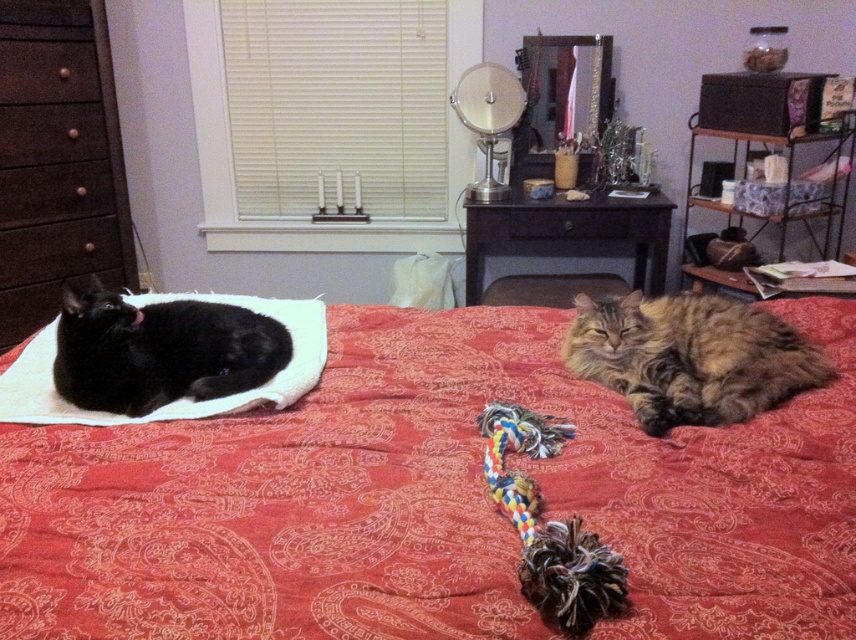
Question: Is tabby fur cat at center smaller than matte black cat at left?

Choices:
 (A) yes
 (B) no

Answer: (B)

Question: Does smooth red fabric bed at center have a smaller size compared to brown wood drawer at left?

Choices:
 (A) no
 (B) yes

Answer: (A)

Question: Which point is closer to the camera?

Choices:
 (A) (798, 502)
 (B) (242, 378)

Answer: (A)

Question: Does tabby fur cat at center appear on the left side of brown wood drawer at left?

Choices:
 (A) no
 (B) yes

Answer: (A)

Question: Which of the following is the closest to the observer?

Choices:
 (A) (690, 512)
 (B) (159, 397)

Answer: (A)

Question: Estimate the real-world distances between objects in this image. Which object is closer to the tabby fur cat at center?

Choices:
 (A) dark brown wood dresser at left
 (B) brown wood drawer at left

Answer: (A)